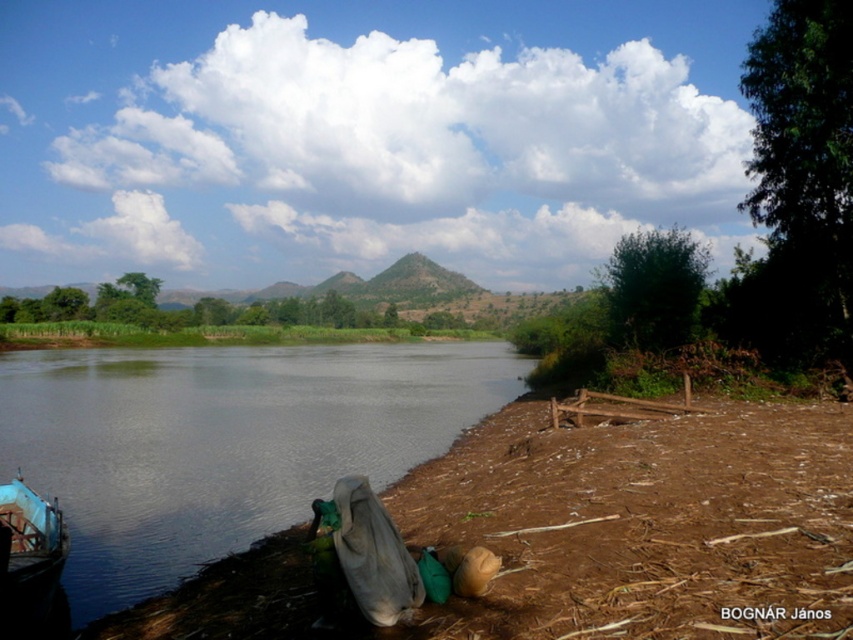
Can you confirm if brown dirt at lower left is positioned below blue wooden boat at lower left?

Actually, brown dirt at lower left is above blue wooden boat at lower left.

Looking at this image, between brown dirt at lower left and blue wooden boat at lower left, which one is positioned lower?

Positioned lower is blue wooden boat at lower left.

Locate an element on the screen. brown dirt at lower left is located at coordinates (584, 536).

The image size is (853, 640). I want to click on smooth dark water at lower left, so click(x=223, y=442).

This screenshot has width=853, height=640. What do you see at coordinates (223, 442) in the screenshot?
I see `smooth dark water at lower left` at bounding box center [223, 442].

Which is behind, point (239, 531) or point (42, 552)?

Point (239, 531)

Where is `smooth dark water at lower left`? smooth dark water at lower left is located at coordinates (223, 442).

Is brown dirt at lower left to the left of smooth dark water at lower left from the viewer's perspective?

In fact, brown dirt at lower left is to the right of smooth dark water at lower left.

Is brown dirt at lower left above smooth dark water at lower left?

Indeed, brown dirt at lower left is positioned over smooth dark water at lower left.

The height and width of the screenshot is (640, 853). I want to click on brown dirt at lower left, so click(x=584, y=536).